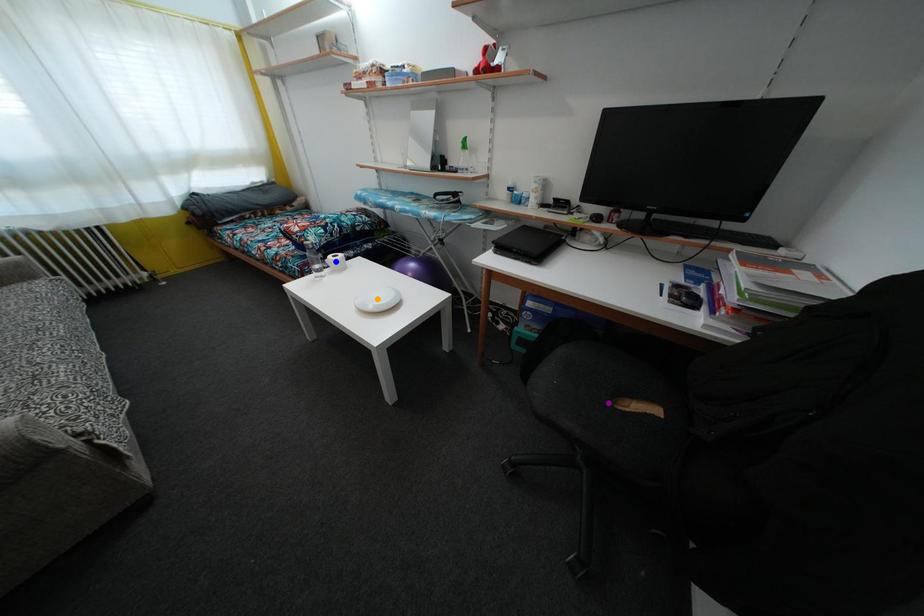
Order these from nearest to farthest:
orange point | blue point | purple point

blue point → orange point → purple point